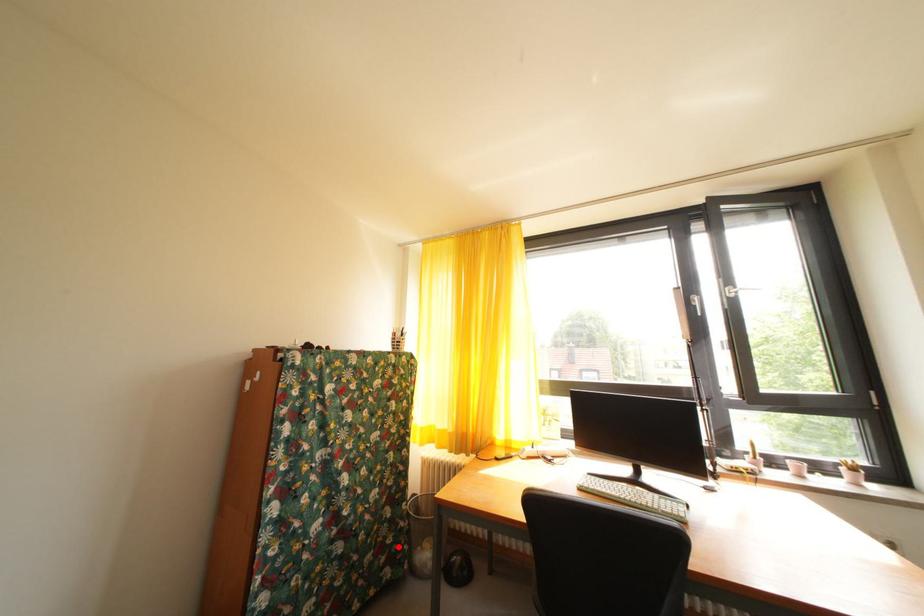
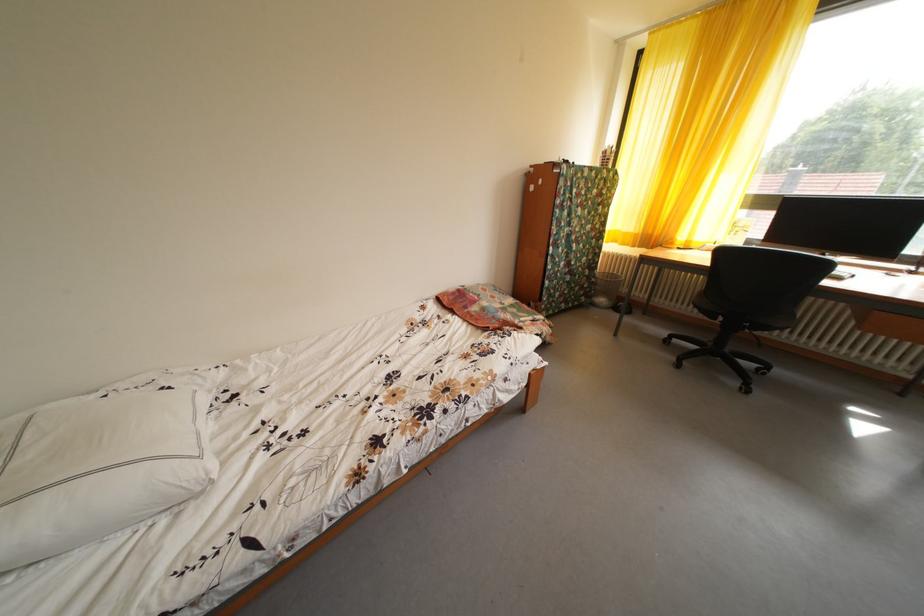
The point at the highlighted location is marked in the first image. Where is the corresponding point in the second image?

(594, 292)